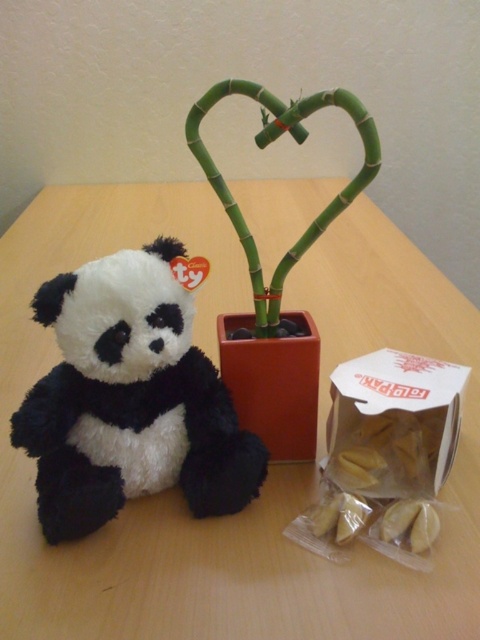
Question: Can you confirm if wooden table at center is thinner than black plush panda at left?

Choices:
 (A) no
 (B) yes

Answer: (A)

Question: Which of the following is the closest to the observer?

Choices:
 (A) wooden table at center
 (B) white paper fortune cookies at lower right
 (C) matte orange pot at center
 (D) black plush panda at left

Answer: (A)

Question: Can you confirm if matte orange pot at center is positioned above green bamboo at center?

Choices:
 (A) yes
 (B) no

Answer: (B)

Question: Can you confirm if black plush panda at left is positioned to the right of white paper fortune cookies at lower right?

Choices:
 (A) yes
 (B) no

Answer: (B)

Question: Which object appears closest to the camera in this image?

Choices:
 (A) white paper fortune cookies at lower right
 (B) wooden table at center
 (C) matte orange pot at center

Answer: (B)

Question: Among these objects, which one is nearest to the camera?

Choices:
 (A) black plush panda at left
 (B) white paper fortune cookies at lower right
 (C) green bamboo at center
 (D) matte orange pot at center

Answer: (C)